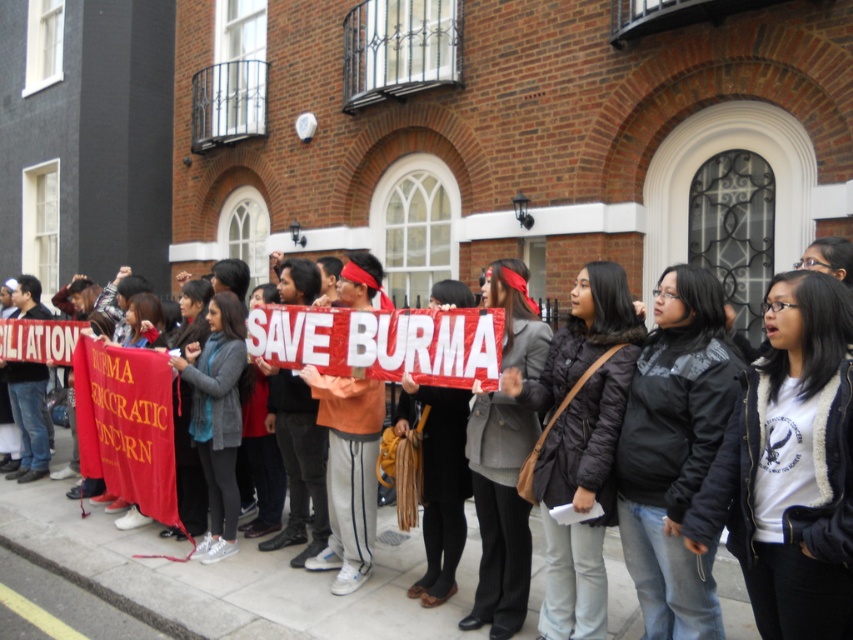
You are a photographer standing at the scene. You want to take a photo of the dark brown puffer jacket at center without any people in the foreground. What is the minimum distance you should move forward to ensure the jacket is the main focus?

The minimum distance you should move forward is 3.67 meters to ensure the dark brown puffer jacket at center is the main focus without any people in the foreground.

You are a photographer trying to capture a photo of the dark brown puffer jacket at center and the matte red banner at center. Which object is wider in the image?

The dark brown puffer jacket at center is wider than the matte red banner at center.